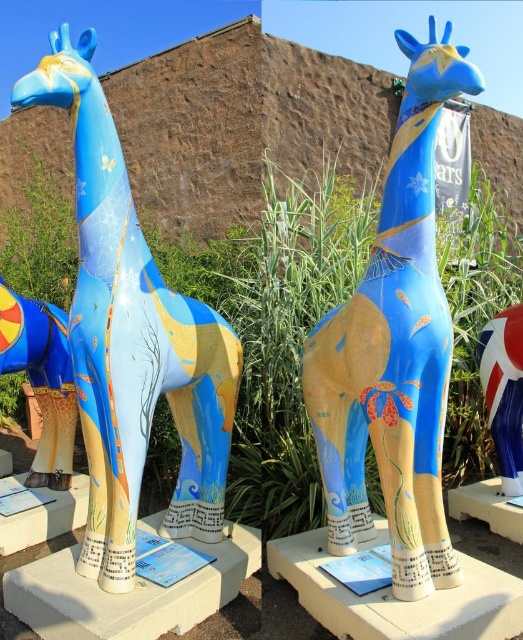
You are an art curator planning to display two giraffe sculptures in a gallery. The space available is 3 meters wide. You have the matte blue giraffe at center and the matte painted giraffe at center. If the total width of both sculptures combined is 2.8 meters, can they fit side by side in the space?

The matte blue giraffe at center is wider than the matte painted giraffe at center. Since their combined width is 2.8 meters, which is less than the 3 meters available, they can fit side by side in the space.

You are a photographer planning to take a photo of both the matte blue giraffe at center and the matte yellow giraffe at left. Since you want to ensure both are clearly visible, which giraffe should you focus on first to account for their sizes?

You should focus on the matte yellow giraffe at left first because it is smaller and might require closer attention to capture details clearly, while the matte blue giraffe at center is larger and its details will be more naturally in focus.

You are standing in front of the two giraffe sculptures. The one you are looking at is the matte painted giraffe at center. Where exactly is it located in terms of coordinates?

The matte painted giraffe at center is located at coordinates point (394,348).